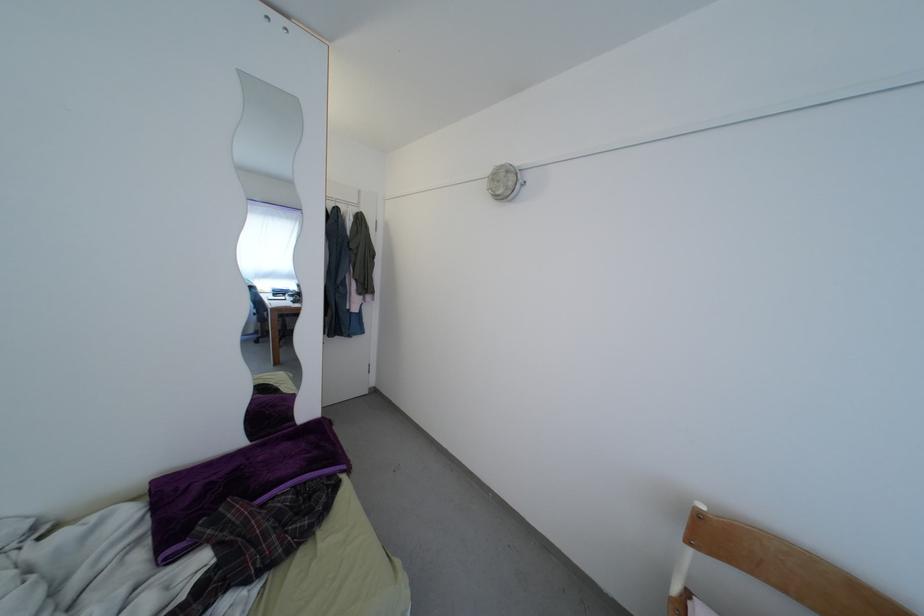
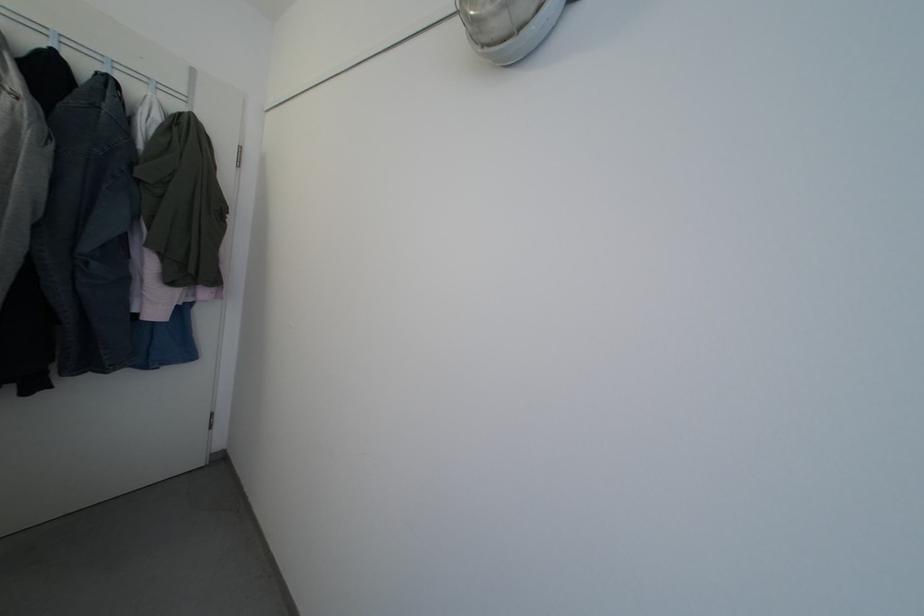
Question: Which direction would the cameraman need to move to produce the second image? Reply with the corresponding letter.

Choices:
 (A) Left
 (B) Right
 (C) Forward
 (D) Backward

Answer: (C)